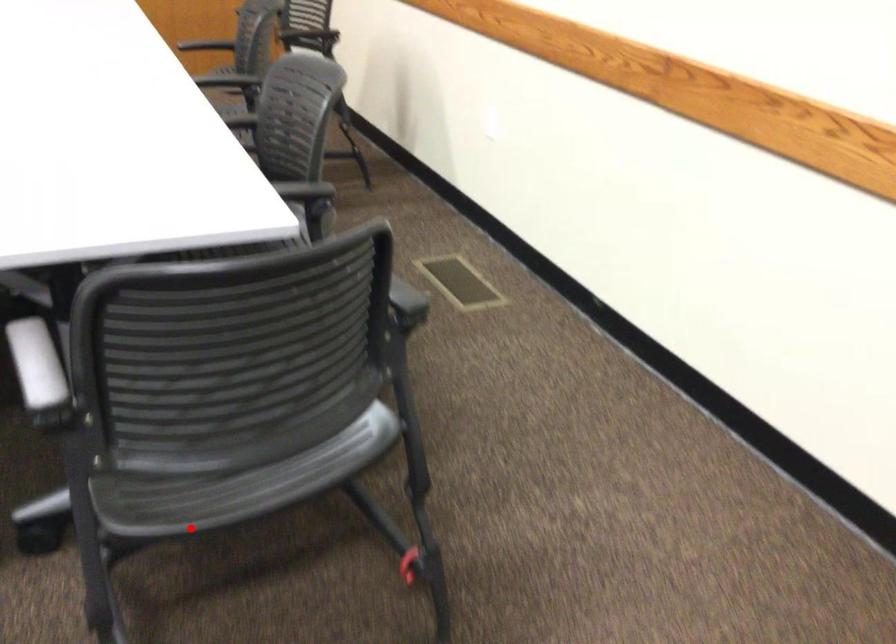
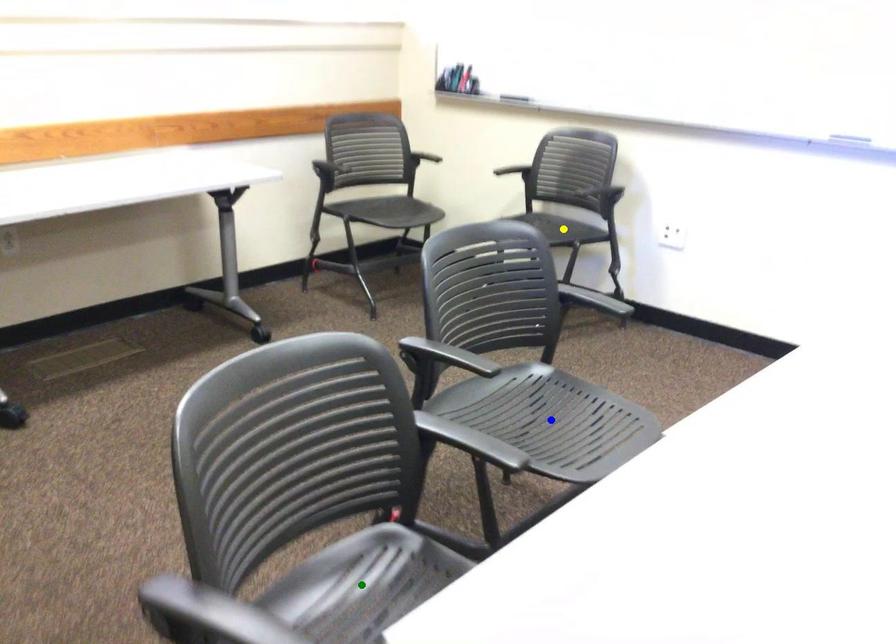
Question: I am providing you with two images of the same scene from different viewpoints. A red point is marked on the first image. You are given multiple points on the second image. Which spot in image 2 lines up with the point in image 1?

Choices:
 (A) blue point
 (B) yellow point
 (C) green point

Answer: (C)